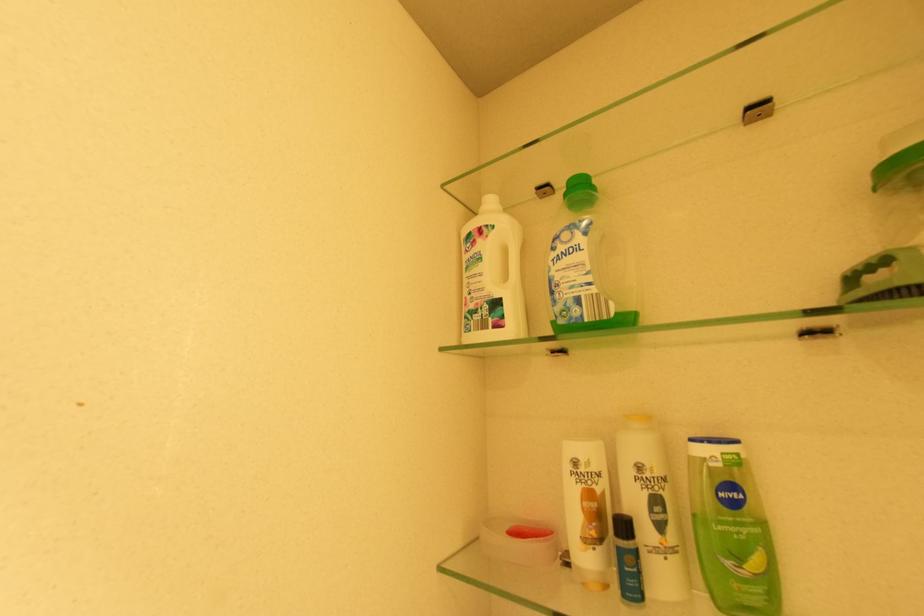
Find the location of `gold bottle cap`. gold bottle cap is located at coordinates pos(638,419).